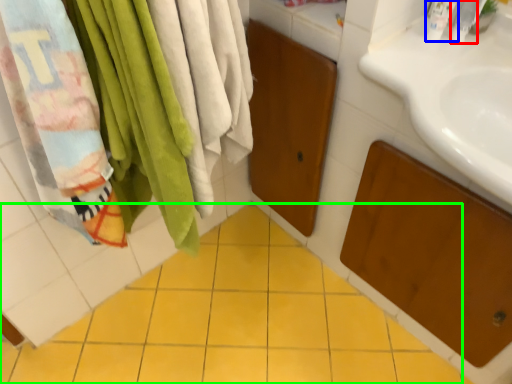
Question: Which is nearer to the toiletry (highlighted by a red box)? toiletry (highlighted by a blue box) or ceramic tile (highlighted by a green box).

Choices:
 (A) toiletry
 (B) ceramic tile

Answer: (A)